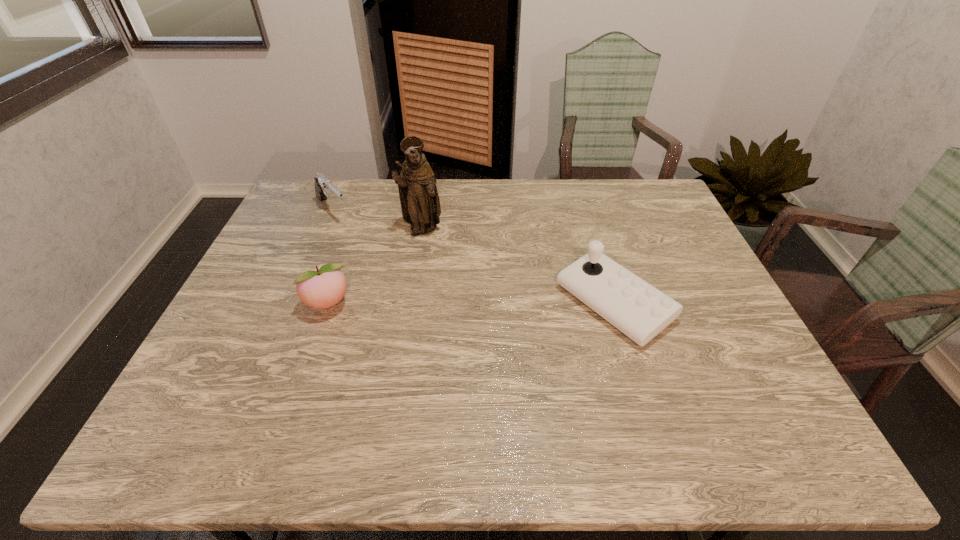
Identify the location of vacant space at the right edge of the desktop. (660, 225).

This screenshot has width=960, height=540. In the image, there is a desktop. What are the coordinates of `free region at the far right corner` in the screenshot? It's located at (635, 217).

Where is `free point at the near right corner`? free point at the near right corner is located at coordinates pyautogui.click(x=710, y=370).

Locate an element on the screen. free space between the gun and the tallest object is located at coordinates (377, 220).

The image size is (960, 540). I want to click on empty space that is in between the joystick and the tallest object, so click(517, 267).

The width and height of the screenshot is (960, 540). In order to click on free area in between the gun and the joystick in this screenshot , I will do `click(473, 256)`.

This screenshot has height=540, width=960. I want to click on free space that is in between the rightmost object and the gun, so click(473, 256).

Locate an element on the screen. The width and height of the screenshot is (960, 540). free space between the joystick and the gun is located at coordinates (473, 256).

Where is `free space between the peach and the joystick`? Image resolution: width=960 pixels, height=540 pixels. free space between the peach and the joystick is located at coordinates (471, 304).

Image resolution: width=960 pixels, height=540 pixels. Find the location of `free point between the joystick and the tallest object`. free point between the joystick and the tallest object is located at coordinates (517, 267).